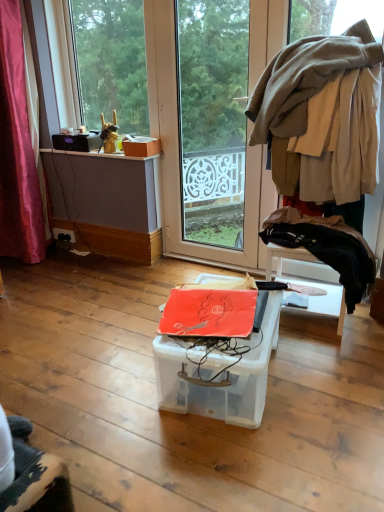
You are a GUI agent. You are given a task and a screenshot of the screen. Output one action in this format:
    pyautogui.click(x=<x>, y=<y>)
    Task: Click on the beige woolen sweater at upper right, which is counted as the first clothing, starting from the top
    The width and height of the screenshot is (384, 512).
    Given the screenshot: What is the action you would take?
    pyautogui.click(x=305, y=79)

Measure the distance between beige woolen sweater at upper right, acting as the 2th clothing starting from the bottom, and camera.

beige woolen sweater at upper right, acting as the 2th clothing starting from the bottom, is 6.29 feet from camera.

What is the approximate width of transparent glass window at upper left?

The width of transparent glass window at upper left is 2.60 inches.

Measure the distance between point (x=155, y=146) and camera.

Point (x=155, y=146) is 2.84 meters from camera.

The width and height of the screenshot is (384, 512). Identify the location of matte cardboard box at upper left. (141, 146).

This screenshot has height=512, width=384. Find the location of `black fabric at right, which is the 1th clothing from bottom to top`. black fabric at right, which is the 1th clothing from bottom to top is located at coordinates (326, 247).

I want to click on black plastic power outlet at lower left, so click(64, 234).

Considering the sizes of objects matte cardboard box at upper left and transparent glass screen door at center in the image provided, who is taller, matte cardboard box at upper left or transparent glass screen door at center?

transparent glass screen door at center is taller.

This screenshot has height=512, width=384. In the image, there is a transparent glass screen door at center. In order to click on storage box below it (from a real-world perspective) in this screenshot , I will do `click(141, 146)`.

From the image's perspective, is matte cardboard box at upper left on top of transparent glass screen door at center?

No, from the image's perspective, matte cardboard box at upper left is not on top of transparent glass screen door at center.

Is point (144, 151) positioned behind point (233, 214)?

No, (144, 151) is in front of (233, 214).

Is point (309, 38) positioned behind point (352, 286)?

Yes, point (309, 38) is behind point (352, 286).

Are beige woolen sweater at upper right, acting as the 2th clothing starting from the bottom, and black fabric at right, which is the 1th clothing from bottom to top, making contact?

No, beige woolen sweater at upper right, acting as the 2th clothing starting from the bottom, is not next to black fabric at right, which is the 1th clothing from bottom to top.

Considering the relative sizes of beige woolen sweater at upper right, acting as the 2th clothing starting from the bottom, and black fabric at right, which is the 1th clothing from bottom to top, in the image provided, is beige woolen sweater at upper right, acting as the 2th clothing starting from the bottom, bigger than black fabric at right, which is the 1th clothing from bottom to top,?

Yes.

Between beige woolen sweater at upper right, acting as the 2th clothing starting from the bottom, and black fabric at right, which is the 1th clothing from bottom to top, which one has more height?

beige woolen sweater at upper right, acting as the 2th clothing starting from the bottom, is taller.

Is black plastic power outlet at lower left closer to camera compared to transparent glass screen door at center?

No, the depth of black plastic power outlet at lower left is greater than that of transparent glass screen door at center.

Find the location of a particular element. Image resolution: width=384 pixels, height=512 pixels. screen door in front of the black plastic power outlet at lower left is located at coordinates (214, 125).

From the image's perspective, is black plastic power outlet at lower left above or below transparent glass screen door at center?

black plastic power outlet at lower left is situated lower than transparent glass screen door at center in the image.

How distant is black plastic power outlet at lower left from transparent glass screen door at center?

The distance of black plastic power outlet at lower left from transparent glass screen door at center is 6.61 feet.

Can you confirm if black fabric at right, which is the 1th clothing from bottom to top, is shorter than transparent plastic box at center?

In fact, black fabric at right, which is the 1th clothing from bottom to top, may be taller than transparent plastic box at center.

Is black fabric at right, which is the second clothing from top to bottom, closer to camera compared to transparent plastic box at center?

No, black fabric at right, which is the second clothing from top to bottom, is further to the viewer.

From the image's perspective, is black fabric at right, which is the second clothing from top to bottom, on top of transparent plastic box at center?

Yes, from the image's perspective, black fabric at right, which is the second clothing from top to bottom, is above transparent plastic box at center.

Is black fabric at right, which is the 1th clothing from bottom to top, situated inside transparent plastic box at center or outside?

black fabric at right, which is the 1th clothing from bottom to top, lies outside transparent plastic box at center.

Does beige woolen sweater at upper right, acting as the 2th clothing starting from the bottom, have a lesser height compared to matte orange box at upper left?

No, beige woolen sweater at upper right, acting as the 2th clothing starting from the bottom, is not shorter than matte orange box at upper left.

The width and height of the screenshot is (384, 512). What are the coordinates of `the 2nd clothing to the right of the matte orange box at upper left, counting from the anchor's position` in the screenshot? It's located at (305, 79).

In terms of width, does beige woolen sweater at upper right, acting as the 2th clothing starting from the bottom, look wider or thinner when compared to matte orange box at upper left?

In the image, beige woolen sweater at upper right, acting as the 2th clothing starting from the bottom, appears to be wider than matte orange box at upper left.

Does matte cardboard box at upper left come behind black plastic power outlet at lower left?

No, it is in front of black plastic power outlet at lower left.

Does matte cardboard box at upper left have a lesser height compared to black plastic power outlet at lower left?

Yes, matte cardboard box at upper left is shorter than black plastic power outlet at lower left.

From the picture: Does matte cardboard box at upper left have a greater width compared to black plastic power outlet at lower left?

Correct, the width of matte cardboard box at upper left exceeds that of black plastic power outlet at lower left.

Is matte cardboard box at upper left turned away from black plastic power outlet at lower left?

No.

Looking at their sizes, would you say black plastic power outlet at lower left is wider or thinner than transparent plastic box at center?

black plastic power outlet at lower left is thinner than transparent plastic box at center.

From the image's perspective, relative to transparent plastic box at center, is black plastic power outlet at lower left above or below?

black plastic power outlet at lower left is situated higher than transparent plastic box at center in the image.

Which is more to the left, black plastic power outlet at lower left or transparent plastic box at center?

black plastic power outlet at lower left.

Is black plastic power outlet at lower left completely or partially outside of transparent plastic box at center?

That's correct, black plastic power outlet at lower left is outside of transparent plastic box at center.

Where is `storage box that appears behind the transparent glass screen door at center`? storage box that appears behind the transparent glass screen door at center is located at coordinates (141, 146).

Where is `clothing above the black fabric at right, which is the second clothing from top to bottom (from the image's perspective)`? clothing above the black fabric at right, which is the second clothing from top to bottom (from the image's perspective) is located at coordinates (305, 79).

Based on their spatial positions, is black fabric at right, which is the second clothing from top to bottom, or transparent glass screen door at center further from transparent glass window at upper left?

black fabric at right, which is the second clothing from top to bottom, is further to transparent glass window at upper left.

When comparing their distances from matte orange box at upper left, does transparent glass window at upper left or matte cardboard box at upper left seem further?

transparent glass window at upper left is further to matte orange box at upper left.

Considering their positions, is black fabric at right, which is the second clothing from top to bottom, positioned closer to transparent plastic box at center than matte cardboard box at upper left?

The object closer to transparent plastic box at center is black fabric at right, which is the second clothing from top to bottom.

Based on their spatial positions, is transparent glass window at upper left or black fabric at right, which is the 1th clothing from bottom to top, further from transparent glass screen door at center?

The object further to transparent glass screen door at center is transparent glass window at upper left.

Looking at the image, which one is located further to black plastic power outlet at lower left, transparent glass window at upper left or transparent plastic box at center?

Based on the image, transparent glass window at upper left appears to be further to black plastic power outlet at lower left.

Considering their positions, is transparent glass window at upper left positioned closer to black fabric at right, which is the 1th clothing from bottom to top, than black plastic power outlet at lower left?

black plastic power outlet at lower left is closer to black fabric at right, which is the 1th clothing from bottom to top.

From the image, which object appears to be nearer to black fabric at right, which is the 1th clothing from bottom to top, beige woolen sweater at upper right, acting as the 2th clothing starting from the bottom, or matte orange box at upper left?

beige woolen sweater at upper right, acting as the 2th clothing starting from the bottom, is closer to black fabric at right, which is the 1th clothing from bottom to top.

Considering their positions, is matte cardboard box at upper left positioned further to transparent plastic box at center than transparent glass screen door at center?

The object further to transparent plastic box at center is transparent glass screen door at center.

Find the location of a particular element. screen door between beige woolen sweater at upper right, which is counted as the first clothing, starting from the top, and transparent plastic box at center, in the vertical direction is located at coordinates (214, 125).

At what (x,y) coordinates should I click in order to perform the action: click on storage box between transparent plastic box at center and black plastic power outlet at lower left from front to back. Please return your answer as a coordinate pair (x, y). Looking at the image, I should click on (141, 146).

Where is `clothing between transparent glass window at upper left and beige woolen sweater at upper right, which is counted as the first clothing, starting from the top`? Image resolution: width=384 pixels, height=512 pixels. clothing between transparent glass window at upper left and beige woolen sweater at upper right, which is counted as the first clothing, starting from the top is located at coordinates (326, 247).

The image size is (384, 512). In order to click on clothing between transparent glass screen door at center and transparent plastic box at center from top to bottom in this screenshot , I will do pyautogui.click(x=326, y=247).